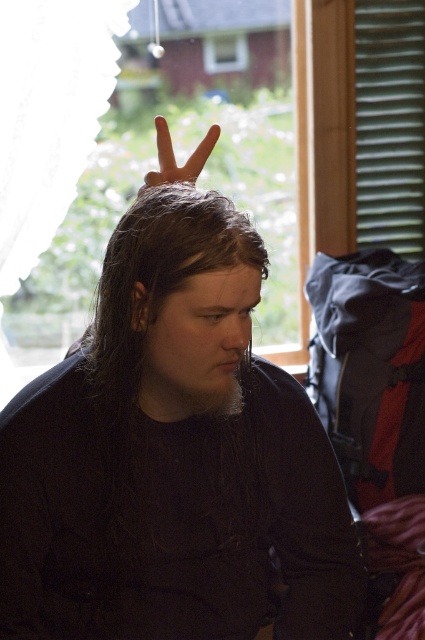
Who is higher up, black matte shirt at center or dark brown hair at center?

Positioned higher is dark brown hair at center.

Does black matte shirt at center have a larger size compared to dark brown hair at center?

Yes.

Describe the element at coordinates (172, 460) in the screenshot. I see `black matte shirt at center` at that location.

The width and height of the screenshot is (425, 640). Find the location of `black matte shirt at center`. black matte shirt at center is located at coordinates 172,460.

Does black matte shirt at center appear on the left side of matte skin hand at center?

No, black matte shirt at center is not to the left of matte skin hand at center.

Between black matte shirt at center and matte skin hand at center, which one is positioned higher?

Positioned higher is matte skin hand at center.

Is point (87, 396) more distant than point (155, 124)?

No, it is not.

Where is `black matte shirt at center`? The image size is (425, 640). black matte shirt at center is located at coordinates (172, 460).

Can you confirm if dark brown hair at center is positioned to the right of matte skin hand at center?

No, dark brown hair at center is not to the right of matte skin hand at center.

Is dark brown hair at center thinner than matte skin hand at center?

In fact, dark brown hair at center might be wider than matte skin hand at center.

Is point (122, 321) more distant than point (144, 182)?

No, (122, 321) is closer to viewer.

Find the location of a particular element. dark brown hair at center is located at coordinates (159, 272).